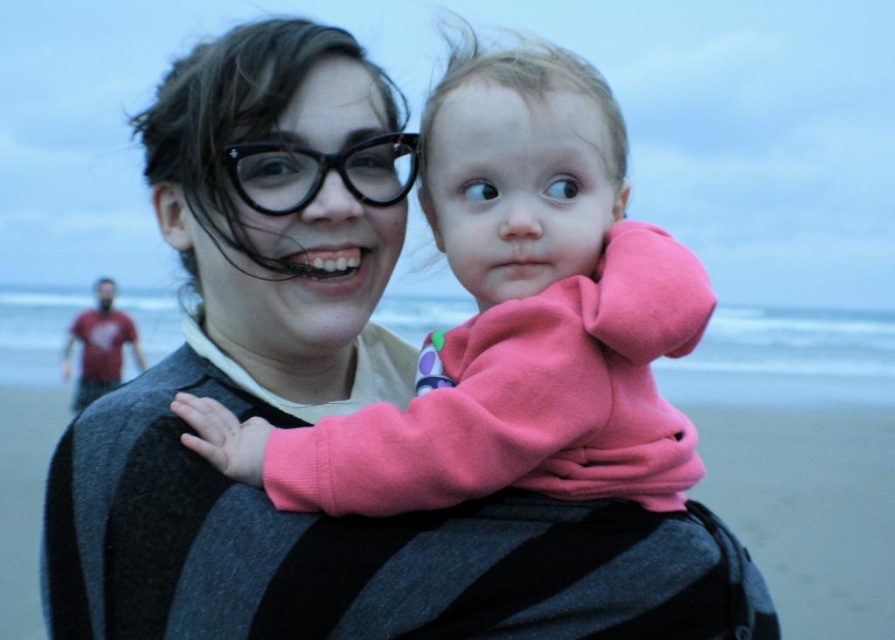
You are a fashion designer observing the beach scene. You need to determine which garment has a wider width between the matte black sweater at center and the pink fleece at center. Which one is wider?

The pink fleece at center has a wider width than the matte black sweater at center.

You are standing at point (x=442, y=100) and want to move to the beach exit located at point (x=367, y=337). Can you walk directly towards the exit without going around any obstacles?

Point (x=367, y=337) is behind point (x=442, y=100), so you can walk directly towards the exit without needing to go around any obstacles.

You are a photographer trying to capture the perfect shot of the matte black sweater at center. The camera you are using has a focal point system that requires you to input coordinates. What coordinates should you enter to ensure the sweater is in the center of the frame?

The coordinates to center the matte black sweater at center should be set to point (237, 365) as specified in the description.